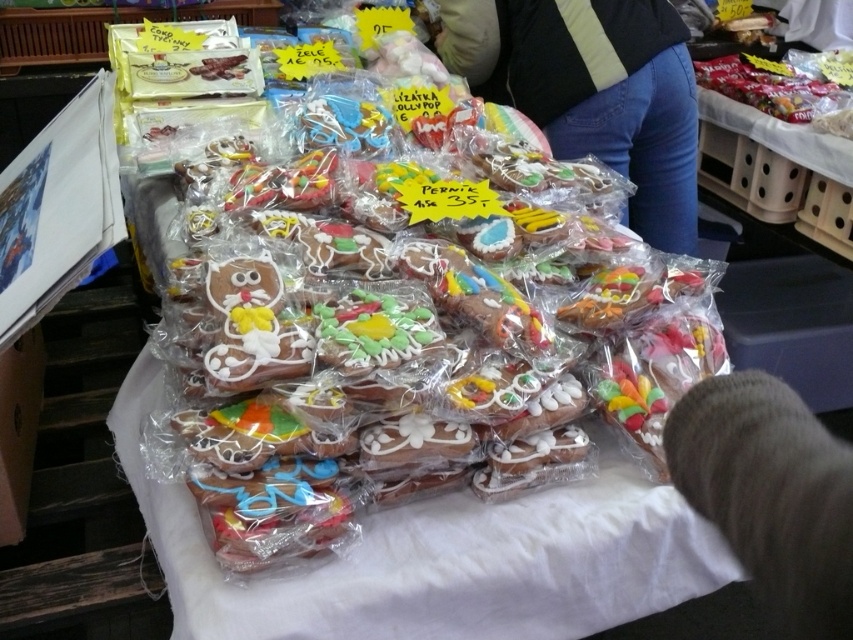
You are a customer at the market looking to buy the blue jeans at center and the fuzzy gray hair at lower right. The vendor requires that items must be placed side by side to be purchased together. Given their widths, will they fit side by side on the table if the table has a width of 1 meter?

The blue jeans at center is wider than the fuzzy gray hair at lower right. Since the table is 1 meter wide, but the combined width of both items would depend on their individual measurements. However, the description only states that the blue jeans at center is wider, not the exact dimensions. Without knowing the exact widths, it is impossible to determine if they will fit together on the table.

You are a customer at the market and want to buy the blue jeans at center and the fuzzy gray hair at lower right. The store has a rule that items must be at least 1.5 meters apart to qualify for a discount. Can you get the discount?

The blue jeans at center is 1.27 meters from fuzzy gray hair at lower right, which is less than the required 1.5 meters. Therefore, you cannot get the discount.